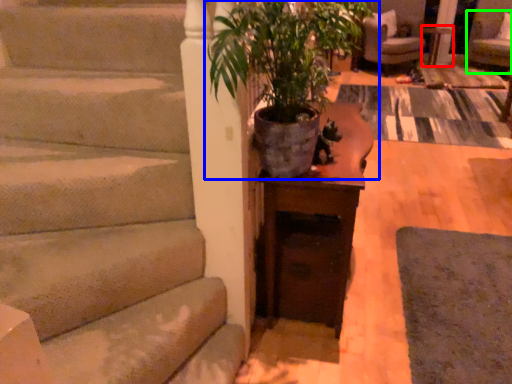
Question: Which is nearer to the side table (highlighted by a red box)? houseplant (highlighted by a blue box) or armchair (highlighted by a green box).

Choices:
 (A) houseplant
 (B) armchair

Answer: (B)